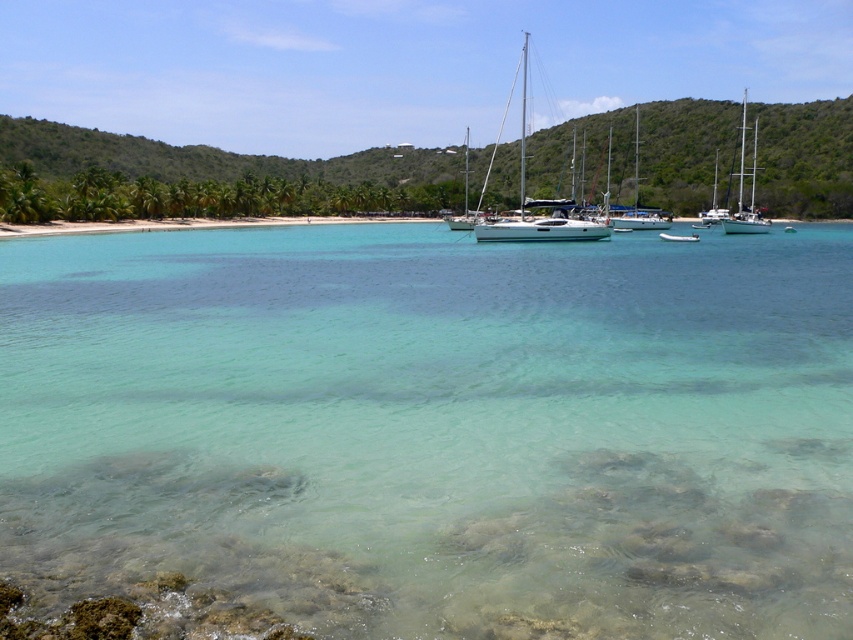
Question: Based on their relative distances, which object is farther from the white glossy sailboat at upper center?

Choices:
 (A) white glossy sailboat at center
 (B) white glossy sailboat at upper right

Answer: (A)

Question: Which point is farther to the camera?

Choices:
 (A) click(693, 236)
 (B) click(573, 202)
 (C) click(738, 189)
 (D) click(286, 349)

Answer: (C)

Question: Is white glossy sailboat at center to the left of white glossy sailboat at upper center from the viewer's perspective?

Choices:
 (A) no
 (B) yes

Answer: (B)

Question: Which point is closer to the camera?

Choices:
 (A) pos(680,236)
 (B) pos(762,228)
 (C) pos(648,221)
 (D) pos(576,230)

Answer: (D)

Question: Is white glossy sailboat at center further to the viewer compared to white glossy boat at center?

Choices:
 (A) no
 (B) yes

Answer: (A)

Question: Is white glossy sailboat at upper right below white glossy boat at center?

Choices:
 (A) no
 (B) yes

Answer: (A)